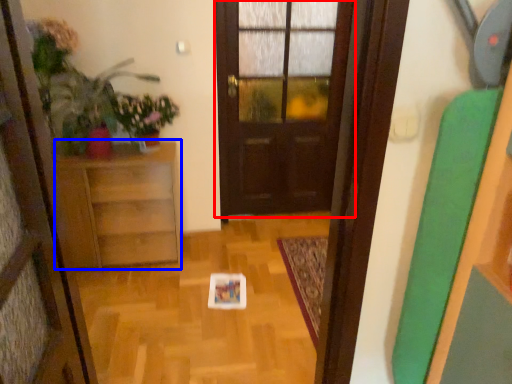
Question: Which object is closer to the camera taking this photo, door (highlighted by a red box) or furniture (highlighted by a blue box)?

Choices:
 (A) door
 (B) furniture

Answer: (B)